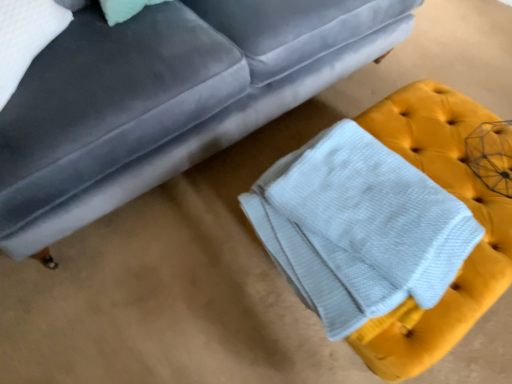
Question: Is velvet gray couch at upper center outside white textured bath towel at lower right?

Choices:
 (A) yes
 (B) no

Answer: (A)

Question: Is velvet gray couch at upper center at the left side of white textured bath towel at lower right?

Choices:
 (A) no
 (B) yes

Answer: (B)

Question: Is velvet gray couch at upper center placed right next to white textured bath towel at lower right?

Choices:
 (A) no
 (B) yes

Answer: (A)

Question: Does velvet gray couch at upper center contain white textured bath towel at lower right?

Choices:
 (A) yes
 (B) no

Answer: (B)

Question: Is the depth of velvet gray couch at upper center greater than that of white textured bath towel at lower right?

Choices:
 (A) no
 (B) yes

Answer: (A)

Question: Can you confirm if velvet gray couch at upper center is taller than white textured bath towel at lower right?

Choices:
 (A) yes
 (B) no

Answer: (A)

Question: Considering the relative positions of white textured bath towel at lower right and velvet gray couch at upper center in the image provided, is white textured bath towel at lower right to the right of velvet gray couch at upper center from the viewer's perspective?

Choices:
 (A) no
 (B) yes

Answer: (B)

Question: Is white textured bath towel at lower right bigger than velvet gray couch at upper center?

Choices:
 (A) no
 (B) yes

Answer: (A)

Question: Can you confirm if white textured bath towel at lower right is shorter than velvet gray couch at upper center?

Choices:
 (A) no
 (B) yes

Answer: (B)

Question: Can you confirm if white textured bath towel at lower right is taller than velvet gray couch at upper center?

Choices:
 (A) yes
 (B) no

Answer: (B)

Question: Does white textured bath towel at lower right have a greater width compared to velvet gray couch at upper center?

Choices:
 (A) no
 (B) yes

Answer: (A)

Question: Does white textured bath towel at lower right have a lesser width compared to velvet gray couch at upper center?

Choices:
 (A) yes
 (B) no

Answer: (A)

Question: Is velvet gray couch at upper center situated inside white textured bath towel at lower right or outside?

Choices:
 (A) inside
 (B) outside

Answer: (B)